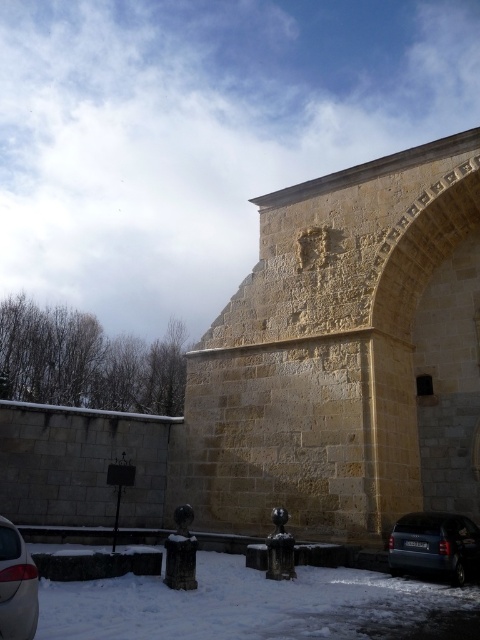
In the scene shown: You are standing at the entrance of the stone building with two ornate black metal bollards and a small signpost. You want to walk to the point marked at coordinates point (201, 426). How far will you have to walk?

The distance between point (201, 426) and the viewer is 35.43 meters, so you will have to walk 35.43 meters to reach the point marked at coordinates point (201, 426).